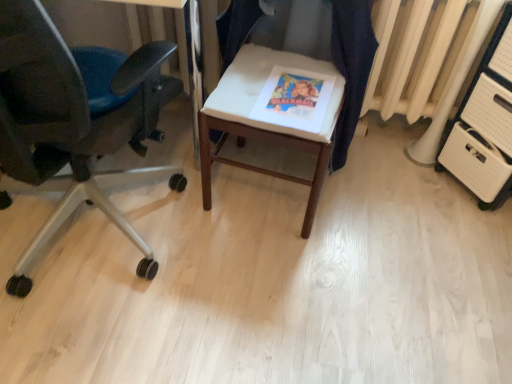
Locate an element on the screen. vacant area situated below matte black office chair at left, the first chair viewed from the left (from a real-world perspective) is located at coordinates (74, 247).